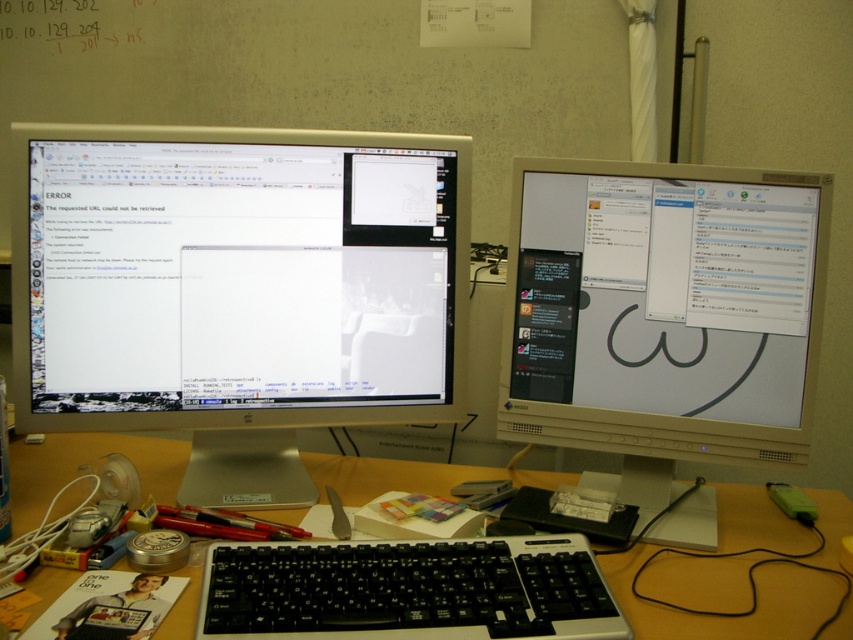
Question: Which of the following is the closest to the observer?

Choices:
 (A) (521, 621)
 (B) (660, 561)

Answer: (A)

Question: Which object is closer to the camera taking this photo?

Choices:
 (A) satin silver monitor at left
 (B) wooden desk at center
 (C) black plastic keyboard at center

Answer: (C)

Question: Is satin silver monitor at left thinner than black plastic keyboard at center?

Choices:
 (A) yes
 (B) no

Answer: (B)

Question: Which object is closer to the camera taking this photo?

Choices:
 (A) beige plastic monitor at right
 (B) black plastic keyboard at center
 (C) satin silver monitor at left

Answer: (B)

Question: Does wooden desk at center appear under black plastic keyboard at center?

Choices:
 (A) no
 (B) yes

Answer: (A)

Question: Is satin silver monitor at left below black plastic keyboard at center?

Choices:
 (A) no
 (B) yes

Answer: (A)